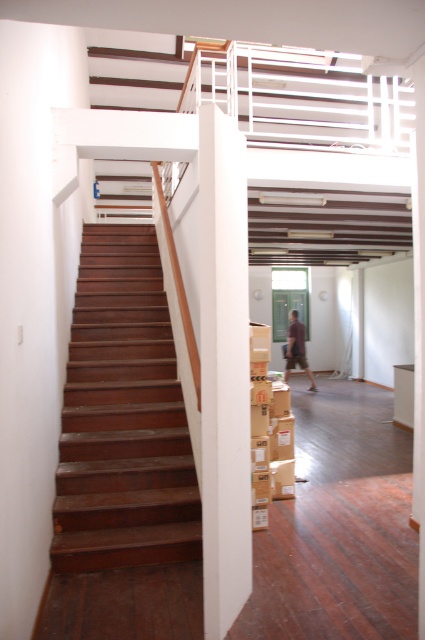
Is dark wood stairs at left thinner than brown fabric pants at center?

In fact, dark wood stairs at left might be wider than brown fabric pants at center.

Who is more forward, (119,234) or (289,362)?

A: Point (119,234) is more forward.

Is point (159, 448) in front of point (289, 337)?

Yes, point (159, 448) is in front of point (289, 337).

The image size is (425, 640). In order to click on dark wood stairs at left in this screenshot , I will do `click(122, 417)`.

Which is in front, point (101, 547) or point (229, 256)?

Point (229, 256) is more forward.

Does dark wood stairs at left appear over white smooth pillar at center?

Incorrect, dark wood stairs at left is not positioned above white smooth pillar at center.

Is point (76, 392) behind point (223, 544)?

Yes, it is behind point (223, 544).

Where is `dark wood stairs at left`? This screenshot has height=640, width=425. dark wood stairs at left is located at coordinates (122, 417).

Is white smooth pillar at center to the right of brown fabric pants at center from the viewer's perspective?

Incorrect, white smooth pillar at center is not on the right side of brown fabric pants at center.

Does point (224, 380) lie in front of point (297, 326)?

That is True.

Find the location of a particular element. The image size is (425, 640). white smooth pillar at center is located at coordinates (223, 369).